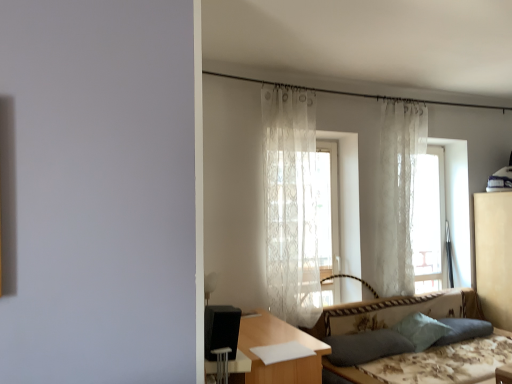
Describe the element at coordinates (397, 193) in the screenshot. I see `white lace curtain at right, the 1th curtain from the right` at that location.

What are the coordinates of `white lace curtain at right, acting as the 2th curtain starting from the left` in the screenshot? It's located at (397, 193).

Measure the distance between point (502, 275) and camera.

They are 12.81 feet apart.

Image resolution: width=512 pixels, height=384 pixels. I want to click on wooden table at center, so click(x=274, y=344).

Is translucent white curtain at center smaller than white lace curtain at right, which ranks as the 1th curtain in back-to-front order?

Actually, translucent white curtain at center might be larger than white lace curtain at right, which ranks as the 1th curtain in back-to-front order.

How many degrees apart are the facing directions of translucent white curtain at center and white lace curtain at right, acting as the 2th curtain starting from the left?

0.175 degrees.

Which point is more forward, (340, 239) or (423, 149)?

Point (340, 239)

Is translucent white curtain at center not inside white lace curtain at right, which ranks as the 1th curtain in back-to-front order?

translucent white curtain at center is positioned outside white lace curtain at right, which ranks as the 1th curtain in back-to-front order.

Is light blue fabric pillow at lower right, acting as the third pillow starting from the left, completely or partially outside of sheer white curtain at center, the second curtain from the back?

Yes.

Considering the relative sizes of light blue fabric pillow at lower right, the 1th pillow when ordered from right to left, and sheer white curtain at center, which is counted as the second curtain, starting from the right, in the image provided, is light blue fabric pillow at lower right, the 1th pillow when ordered from right to left, wider than sheer white curtain at center, which is counted as the second curtain, starting from the right,?

Yes.

Who is more distant, light blue fabric pillow at lower right, the 1th pillow when ordered from right to left, or sheer white curtain at center, the first curtain when ordered from front to back?

light blue fabric pillow at lower right, the 1th pillow when ordered from right to left, is behind.

Which object is positioned more to the left, light blue fabric pillow at lower right, acting as the third pillow starting from the left, or sheer white curtain at center, which is counted as the second curtain, starting from the right?

Positioned to the left is sheer white curtain at center, which is counted as the second curtain, starting from the right.

Is black matte speaker at lower left completely or partially inside white lace curtain at right, acting as the 2th curtain starting from the left?

Actually, black matte speaker at lower left is outside white lace curtain at right, acting as the 2th curtain starting from the left.

In the image, there is a white lace curtain at right, acting as the 2th curtain starting from the left. At what (x,y) coordinates should I click in order to perform the action: click on armchair below it (from a real-world perspective). Please return your answer as a coordinate pair (x, y). Looking at the image, I should click on (221, 336).

Can you confirm if white lace curtain at right, which ranks as the 1th curtain in back-to-front order, is bigger than black matte speaker at lower left?

Yes.

Is point (383, 207) positioned after point (234, 353)?

Yes.

From a real-world perspective, between transparent lace curtain at upper right and white lace curtain at right, acting as the 2th curtain starting from the left, who is vertically higher?

white lace curtain at right, acting as the 2th curtain starting from the left.

Does point (440, 202) come closer to viewer compared to point (395, 247)?

No, (440, 202) is behind (395, 247).

Is transparent lace curtain at upper right smaller than white lace curtain at right, positioned as the second curtain in front-to-back order?

Actually, transparent lace curtain at upper right might be larger than white lace curtain at right, positioned as the second curtain in front-to-back order.

Is transparent lace curtain at upper right wider or thinner than white lace curtain at right, which ranks as the 1th curtain in back-to-front order?

Clearly, transparent lace curtain at upper right has more width compared to white lace curtain at right, which ranks as the 1th curtain in back-to-front order.

Considering the sizes of teal fabric pillow at lower right, the 2th pillow in the left-to-right sequence, and wooden table at center in the image, is teal fabric pillow at lower right, the 2th pillow in the left-to-right sequence, bigger or smaller than wooden table at center?

Considering their sizes, teal fabric pillow at lower right, the 2th pillow in the left-to-right sequence, takes up less space than wooden table at center.

From the image's perspective, between teal fabric pillow at lower right, the 2th pillow in the left-to-right sequence, and wooden table at center, who is located below?

wooden table at center.

Would you say teal fabric pillow at lower right, the 2th pillow in the left-to-right sequence, is inside or outside wooden table at center?

teal fabric pillow at lower right, the 2th pillow in the left-to-right sequence, is not inside wooden table at center, it's outside.

Which is closer to the camera, (x=409, y=329) or (x=289, y=331)?

The point (x=289, y=331) is more forward.

Between transparent lace curtain at upper right and dark fabric pillow at lower right, marked as the first pillow in a left-to-right arrangement, which one has more height?

With more height is transparent lace curtain at upper right.

Where is `the 2nd pillow below the transparent lace curtain at upper right (from the image's perspective)`? The height and width of the screenshot is (384, 512). the 2nd pillow below the transparent lace curtain at upper right (from the image's perspective) is located at coordinates (366, 347).

In the image, is transparent lace curtain at upper right positioned in front of or behind dark fabric pillow at lower right, placed as the 3th pillow when sorted from right to left?

Visually, transparent lace curtain at upper right is located behind dark fabric pillow at lower right, placed as the 3th pillow when sorted from right to left.

Is floral fabric couch at lower right at the left side of sheer white curtain at center, the second curtain from the back?

No, floral fabric couch at lower right is not to the left of sheer white curtain at center, the second curtain from the back.

Between point (469, 379) and point (290, 143), which one is positioned behind?

Point (290, 143)

From a real-world perspective, does floral fabric couch at lower right stand above sheer white curtain at center, the first curtain when ordered from front to back?

No, from a real-world perspective, floral fabric couch at lower right is not above sheer white curtain at center, the first curtain when ordered from front to back.

At what (x,y) coordinates should I click in order to perform the action: click on the 2nd curtain to the left when counting from the floral fabric couch at lower right. Please return your answer as a coordinate pair (x, y). Looking at the image, I should click on (291, 205).

The height and width of the screenshot is (384, 512). I want to click on curtain above the translucent white curtain at center (from a real-world perspective), so click(397, 193).

Image resolution: width=512 pixels, height=384 pixels. I want to click on curtain located in front of the light blue fabric pillow at lower right, the 1th pillow when ordered from right to left, so click(291, 205).

Considering their positions, is black matte speaker at lower left positioned further to sheer white curtain at center, the first curtain when ordered from front to back, than wooden table at center?

black matte speaker at lower left is positioned further to the anchor sheer white curtain at center, the first curtain when ordered from front to back.

Looking at the image, which one is located closer to beige fabric dresser at right, white lace curtain at right, positioned as the second curtain in front-to-back order, or floral fabric couch at lower right?

floral fabric couch at lower right is closer to beige fabric dresser at right.

Based on the photo, from the image, which object appears to be nearer to wooden table at center, transparent lace curtain at upper right or teal fabric pillow at lower right, marked as the 2th pillow in a right-to-left arrangement?

teal fabric pillow at lower right, marked as the 2th pillow in a right-to-left arrangement.

When comparing their distances from floral fabric couch at lower right, does wooden table at center or teal fabric pillow at lower right, the 2th pillow in the left-to-right sequence, seem further?

Among the two, wooden table at center is located further to floral fabric couch at lower right.

Based on their spatial positions, is dark fabric pillow at lower right, marked as the first pillow in a left-to-right arrangement, or teal fabric pillow at lower right, the 2th pillow in the left-to-right sequence, further from black matte speaker at lower left?

teal fabric pillow at lower right, the 2th pillow in the left-to-right sequence.

Considering their positions, is translucent white curtain at center positioned closer to light blue fabric pillow at lower right, the 1th pillow when ordered from right to left, than teal fabric pillow at lower right, marked as the 2th pillow in a right-to-left arrangement?

teal fabric pillow at lower right, marked as the 2th pillow in a right-to-left arrangement, is positioned closer to the anchor light blue fabric pillow at lower right, the 1th pillow when ordered from right to left.

From the picture: Based on their spatial positions, is white lace curtain at right, positioned as the second curtain in front-to-back order, or floral fabric couch at lower right closer to dark fabric pillow at lower right, placed as the 3th pillow when sorted from right to left?

floral fabric couch at lower right is positioned closer to the anchor dark fabric pillow at lower right, placed as the 3th pillow when sorted from right to left.

In the scene shown: From the image, which object appears to be farther from transparent lace curtain at upper right, floral fabric couch at lower right or wooden table at center?

wooden table at center is positioned further to the anchor transparent lace curtain at upper right.

This screenshot has height=384, width=512. Identify the location of screen door that lies between white lace curtain at right, which ranks as the 1th curtain in back-to-front order, and dark fabric pillow at lower right, placed as the 3th pillow when sorted from right to left, from top to bottom. (347, 201).

In order to click on screen door that lies between white lace curtain at right, the 1th curtain from the right, and teal fabric pillow at lower right, marked as the 2th pillow in a right-to-left arrangement, from top to bottom in this screenshot , I will do `click(347, 201)`.

Locate an element on the screen. window located between wooden table at center and beige fabric dresser at right in the left-right direction is located at coordinates (429, 223).

You are a GUI agent. You are given a task and a screenshot of the screen. Output one action in this format:
    pyautogui.click(x=<x>, y=<y>)
    Task: Click on the window located between white lace curtain at right, positioned as the second curtain in front-to-back order, and beige fabric dresser at right in the left-right direction
    
    Given the screenshot: What is the action you would take?
    pyautogui.click(x=429, y=223)